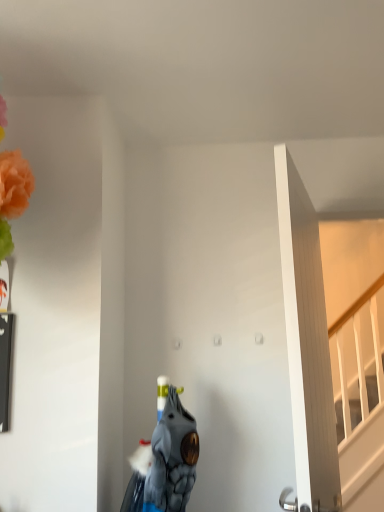
Question: Which is correct: blue fabric animal at center is inside white wooden door at right, or outside of it?

Choices:
 (A) inside
 (B) outside

Answer: (B)

Question: Looking at their shapes, would you say blue fabric animal at center is wider or thinner than white wooden door at right?

Choices:
 (A) wide
 (B) thin

Answer: (A)

Question: Considering the positions of point (150, 490) and point (321, 359), is point (150, 490) closer or farther from the camera than point (321, 359)?

Choices:
 (A) closer
 (B) farther

Answer: (A)

Question: From a real-world perspective, is white wooden door at right above or below blue fabric animal at center?

Choices:
 (A) above
 (B) below

Answer: (A)

Question: In the image, is white wooden door at right positioned in front of or behind blue fabric animal at center?

Choices:
 (A) behind
 (B) front

Answer: (B)

Question: Is white wooden door at right wider or thinner than blue fabric animal at center?

Choices:
 (A) thin
 (B) wide

Answer: (A)

Question: Would you say white wooden door at right is to the left or to the right of blue fabric animal at center in the picture?

Choices:
 (A) right
 (B) left

Answer: (A)